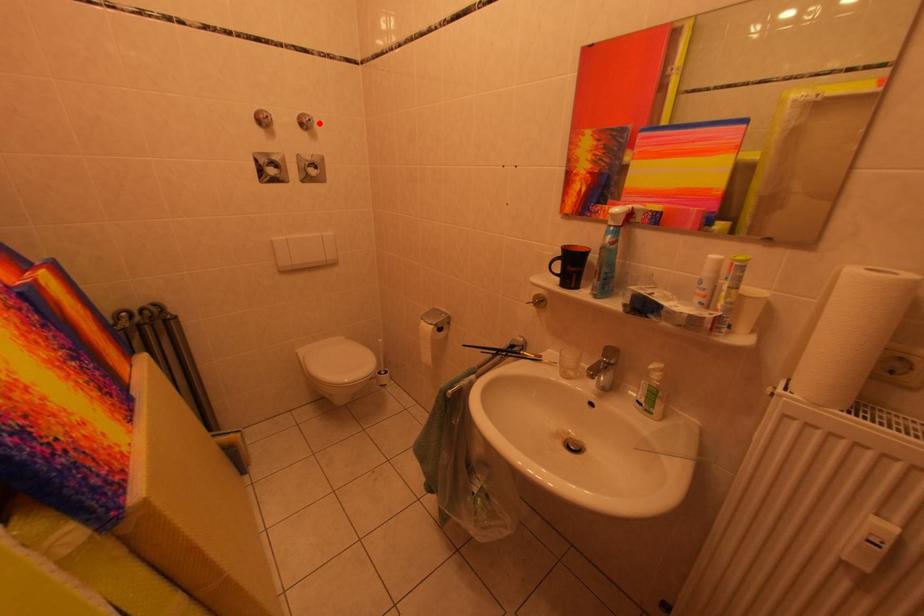
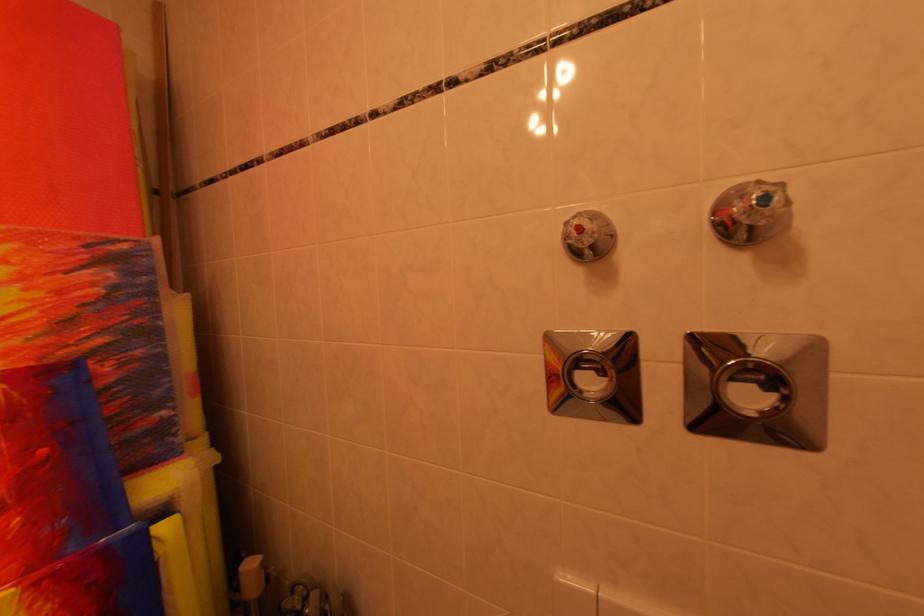
In the second image, find the point that corresponds to the highlighted location in the first image.

(773, 201)